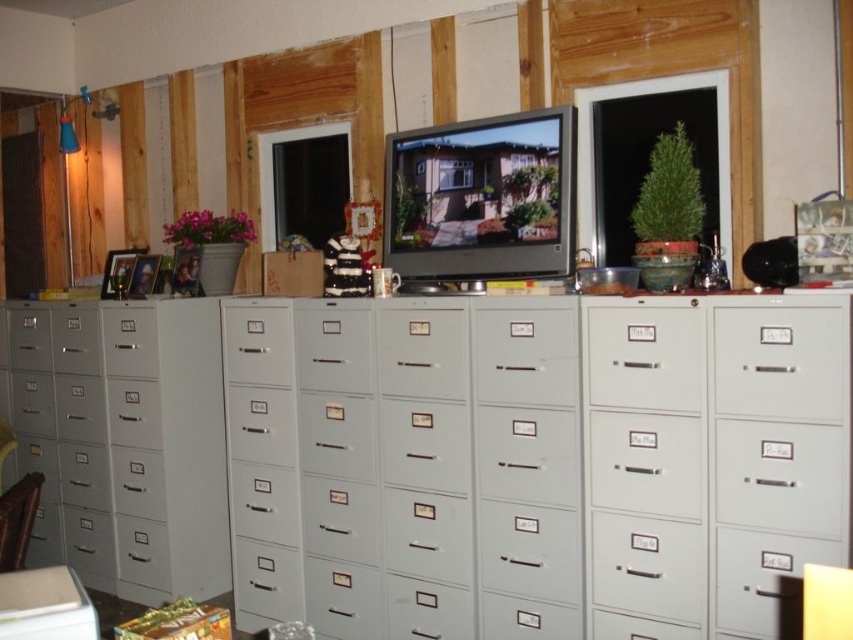
Question: Which of these objects is positioned closest to the matte gray file cabinet at left?

Choices:
 (A) metallic gray filing cabinet at center-right
 (B) gray metal file cabinet at center
 (C) matte gray file cabinet drawer at center

Answer: (B)

Question: Considering the relative positions of matte gray file cabinet drawer at center and white matte file cabinet drawer at center in the image provided, where is matte gray file cabinet drawer at center located with respect to white matte file cabinet drawer at center?

Choices:
 (A) above
 (B) below

Answer: (B)

Question: Which is nearer to the metallic gray filing cabinet at left?

Choices:
 (A) white matte file cabinet drawer at center
 (B) metallic gray filing cabinet at center-right

Answer: (A)

Question: Does gray metal file cabinet at center lie behind matte gray file cabinet drawer at center?

Choices:
 (A) no
 (B) yes

Answer: (A)

Question: Which of these objects is positioned closest to the white matte file cabinet drawer at center?

Choices:
 (A) metallic gray filing cabinet at center-right
 (B) gray metal file cabinet at center
 (C) matte gray file cabinet at left
 (D) matte gray filing cabinet at center

Answer: (A)

Question: Does gray metal file cabinet at center have a greater width compared to matte gray file cabinet at left?

Choices:
 (A) yes
 (B) no

Answer: (A)